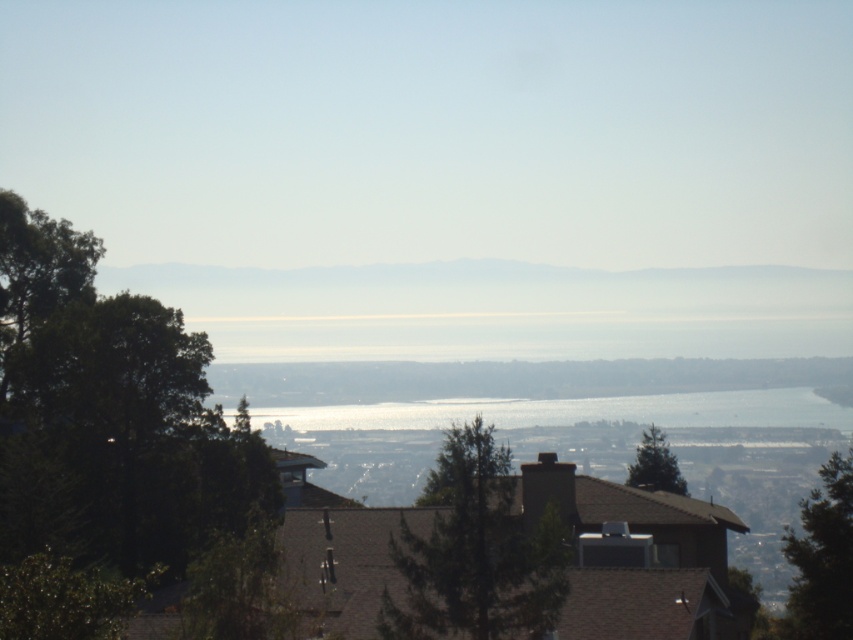
Question: Which point appears farthest from the camera in this image?

Choices:
 (A) (642, 444)
 (B) (723, 403)

Answer: (B)

Question: Which of the following is the closest to the observer?

Choices:
 (A) (413, 419)
 (B) (838, 600)

Answer: (B)

Question: Is clear water at center positioned before green textured tree at right?

Choices:
 (A) yes
 (B) no

Answer: (A)

Question: Which point is farther to the camera?

Choices:
 (A) (93, 554)
 (B) (635, 397)
 (C) (675, 470)

Answer: (B)

Question: Can you confirm if translucent glass water at center is bigger than clear water at center?

Choices:
 (A) no
 (B) yes

Answer: (B)

Question: Is translucent glass water at center wider than green matte tree at center?

Choices:
 (A) yes
 (B) no

Answer: (A)